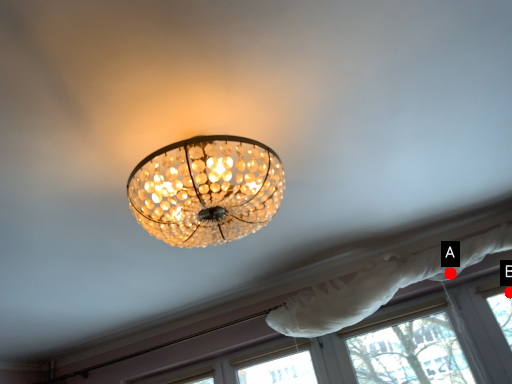
Question: Two points are circled on the image, labeled by A and B beside each circle. Among these points, which one is farthest from the camera?

Choices:
 (A) A is further
 (B) B is further

Answer: (A)